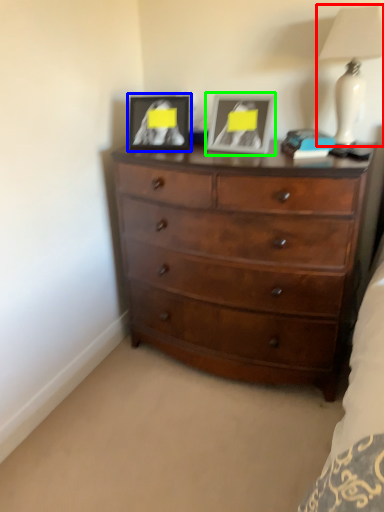
Question: Based on their relative distances, which object is farther from lamp (highlighted by a red box)? Choose from picture frame (highlighted by a blue box) and picture frame (highlighted by a green box).

Choices:
 (A) picture frame
 (B) picture frame

Answer: (A)